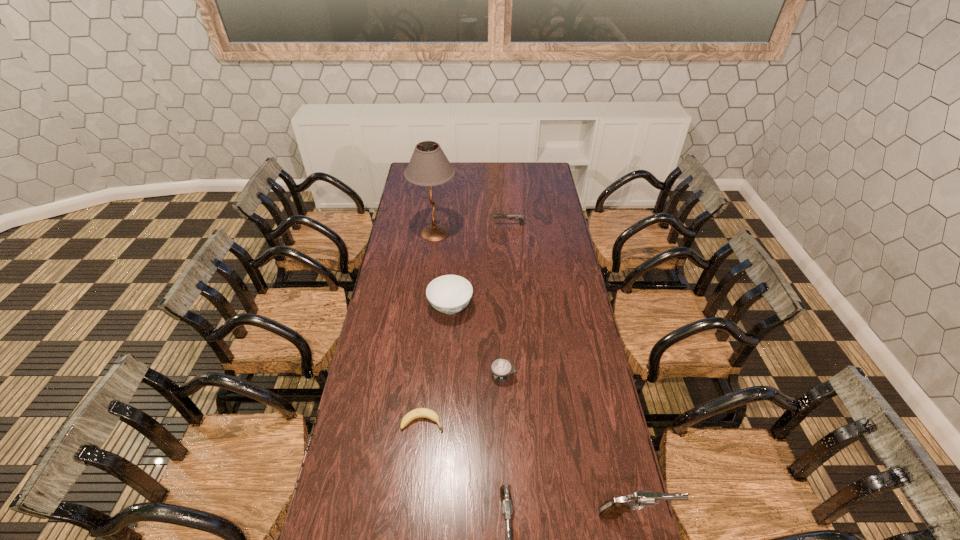
Where is `the rightmost object`? the rightmost object is located at coordinates (611, 509).

Locate an element on the screen. This screenshot has height=540, width=960. the taller pistol is located at coordinates click(x=611, y=509).

The height and width of the screenshot is (540, 960). In order to click on gun in this screenshot , I will do `click(510, 217)`.

Locate an element on the screen. the tallest object is located at coordinates (429, 166).

In order to click on the fifth farthest object in this screenshot , I will do `click(419, 412)`.

Find the location of `the shortest object`. the shortest object is located at coordinates (419, 412).

Image resolution: width=960 pixels, height=540 pixels. What are the coordinates of `the fourth farthest object` in the screenshot? It's located at (501, 368).

At what (x,y) coordinates should I click in order to perform the action: click on the second shortest object. Please return your answer as a coordinate pair (x, y). The width and height of the screenshot is (960, 540). Looking at the image, I should click on (501, 368).

I want to click on the fourth tallest object, so click(449, 294).

You are a GUI agent. You are given a task and a screenshot of the screen. Output one action in this format:
    pyautogui.click(x=<x>, y=<y>)
    Task: Click on the chinaware
    
    Given the screenshot: What is the action you would take?
    pyautogui.click(x=449, y=294)